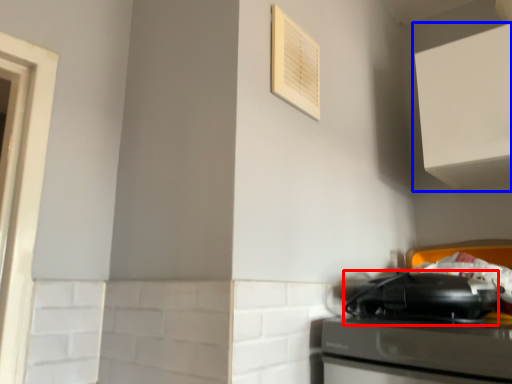
Question: Which object appears closest to the camera in this image, appliance (highlighted by a red box) or cabinetry (highlighted by a blue box)?

Choices:
 (A) appliance
 (B) cabinetry

Answer: (A)